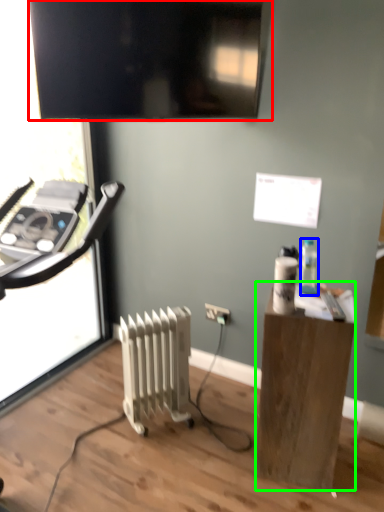
Question: Which object is the farthest from television (highlighted by a red box)? Choose among these: bottle (highlighted by a blue box) or desk (highlighted by a green box).

Choices:
 (A) bottle
 (B) desk

Answer: (B)